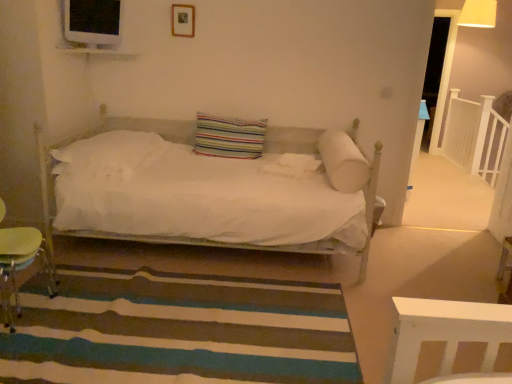
Question: Is white wooden balustrade at upper right to the left or to the right of wooden lampshade at upper right in the image?

Choices:
 (A) right
 (B) left

Answer: (A)

Question: Is white wooden balustrade at upper right wider or thinner than wooden lampshade at upper right?

Choices:
 (A) wide
 (B) thin

Answer: (B)

Question: Considering the real-world distances, which object is closest to the green plastic swivel chair at lower left?

Choices:
 (A) white wooden balustrade at upper right
 (B) white soft pillow at right, which ranks as the first pillow in right-to-left order
 (C) white soft pillow at center, acting as the 3th pillow starting from the right
 (D) striped carpet at lower center
 (E) wooden lampshade at upper right

Answer: (D)

Question: Based on their relative distances, which object is nearer to the striped carpet at lower center?

Choices:
 (A) white soft pillow at right, which ranks as the first pillow in right-to-left order
 (B) wooden lampshade at upper right
 (C) striped fabric pillow at center, acting as the second pillow starting from the right
 (D) wooden picture frame at upper center
 (E) green plastic swivel chair at lower left

Answer: (E)